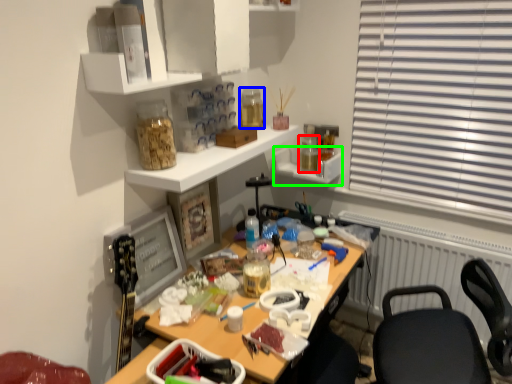
Question: Based on their relative distances, which object is nearer to bottle (highlighted by a red box)? Choose from bottle (highlighted by a blue box) and shelf (highlighted by a green box).

Choices:
 (A) bottle
 (B) shelf

Answer: (B)